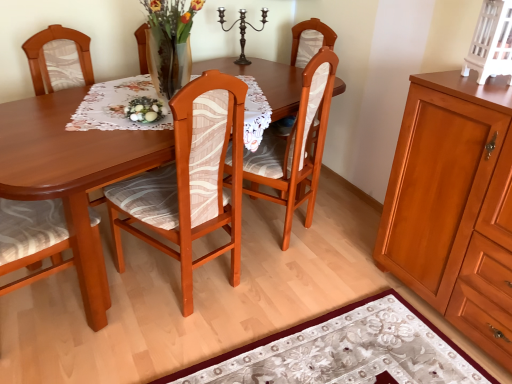
I want to click on free spot to the left of white glossy eggs at center, so click(103, 116).